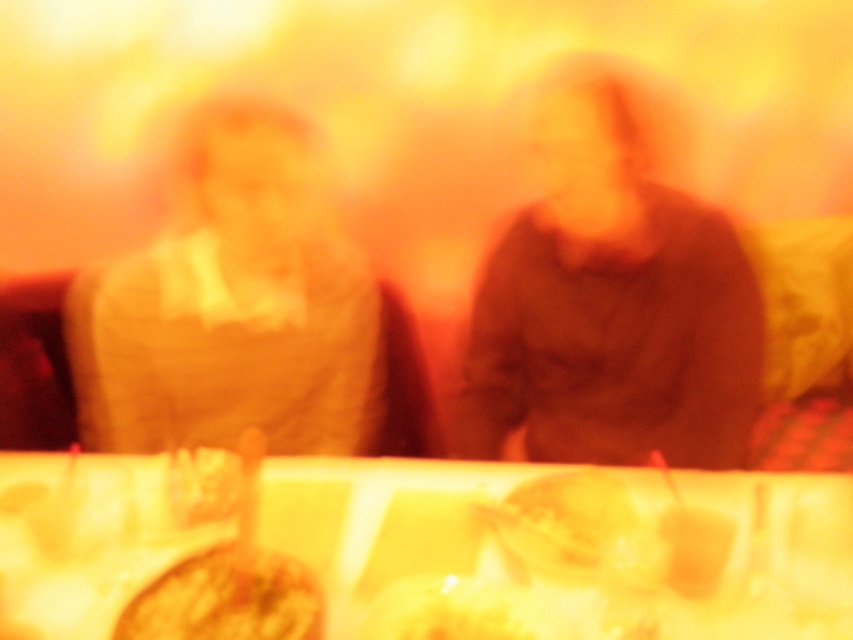
You are organizing a small party and need to place a decorative centerpiece on the wooden table at center. However, there is already a matte brown sweater at center on the table. Can the sweater be moved to make space for the centerpiece without removing it from the table?

The wooden table at center is below the matte brown sweater at center, which means the sweater is currently on the table. To place the centerpiece, the sweater can be moved to another part of the table while keeping it on the surface.

You are standing in front of the blurry image described. You see two points labeled as point (257, 572) and point (575, 310). Which point is nearer to you?

Point (257, 572) is closer to the viewer than point (575, 310).

You are standing in a room with a warm, yellow and orange light. There is a point at coordinates (x=612, y=310). What object is located at that point?

The object at point (x=612, y=310) is the matte brown sweater at center.